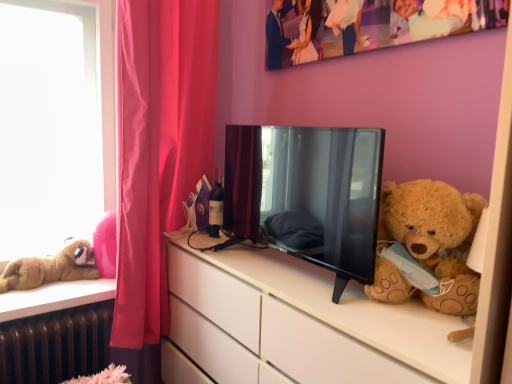
Question: Is white matte cabinet at right thinner than black glossy tv at center?

Choices:
 (A) yes
 (B) no

Answer: (B)

Question: Considering the relative positions of white matte cabinet at right and black glossy tv at center in the image provided, is white matte cabinet at right in front of black glossy tv at center?

Choices:
 (A) yes
 (B) no

Answer: (A)

Question: Would you say black glossy tv at center is part of white matte cabinet at right's contents?

Choices:
 (A) yes
 (B) no

Answer: (B)

Question: Is white matte cabinet at right oriented towards black glossy tv at center?

Choices:
 (A) no
 (B) yes

Answer: (A)

Question: From the image's perspective, would you say white matte cabinet at right is shown under black glossy tv at center?

Choices:
 (A) yes
 (B) no

Answer: (A)

Question: Considering the relative positions of white matte cabinet at right and black glossy tv at center in the image provided, is white matte cabinet at right behind black glossy tv at center?

Choices:
 (A) no
 (B) yes

Answer: (A)

Question: Is there a large distance between white matte cabinet at right and fluffy brown teddy bear at right, acting as the first teddy bear starting from the front?

Choices:
 (A) yes
 (B) no

Answer: (B)

Question: Does white matte cabinet at right have a greater width compared to fluffy brown teddy bear at right, the 2th teddy bear positioned from the back?

Choices:
 (A) yes
 (B) no

Answer: (A)

Question: Is white matte cabinet at right thinner than fluffy brown teddy bear at right, which is the first teddy bear in right-to-left order?

Choices:
 (A) no
 (B) yes

Answer: (A)

Question: From a real-world perspective, is white matte cabinet at right on fluffy brown teddy bear at right, the 2th teddy bear when ordered from left to right?

Choices:
 (A) no
 (B) yes

Answer: (A)

Question: Is white matte cabinet at right positioned behind fluffy brown teddy bear at right, acting as the first teddy bear starting from the front?

Choices:
 (A) no
 (B) yes

Answer: (A)

Question: Considering the relative sizes of white matte cabinet at right and fluffy brown teddy bear at right, the 2th teddy bear when ordered from left to right, in the image provided, is white matte cabinet at right taller than fluffy brown teddy bear at right, the 2th teddy bear when ordered from left to right,?

Choices:
 (A) yes
 (B) no

Answer: (A)

Question: Considering the relative sizes of brown metallic radiator at lower left and matte glass bottle at center in the image provided, is brown metallic radiator at lower left taller than matte glass bottle at center?

Choices:
 (A) yes
 (B) no

Answer: (A)